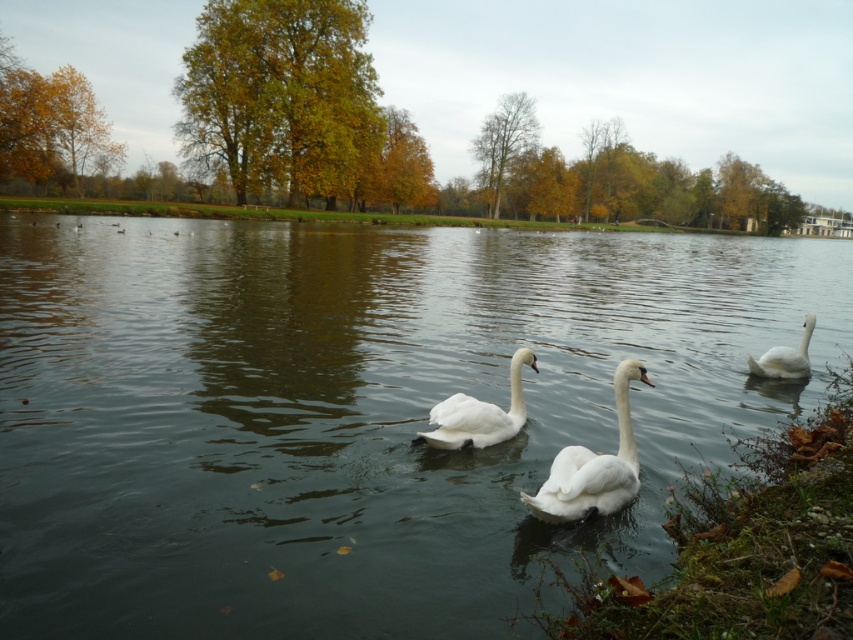
In the scene shown: You are a photographer trying to capture a closeup shot of the white matte swan at center and the white smooth swan at center. Given that your camera lens has a minimum focusing distance of 1.2 meters, will you be able to take the photo without moving closer?

The white matte swan at center and white smooth swan at center are 1.32 meters apart from each other. Since the minimum focusing distance is 1.2 meters, the photographer can take the photo without moving closer because the distance between them is greater than the required minimum focusing distance.